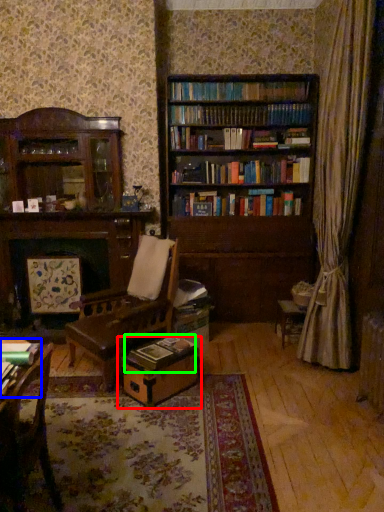
Question: Based on their relative distances, which object is nearer to cardboard box (highlighted by a red box)? Choose from book (highlighted by a blue box) and book (highlighted by a green box).

Choices:
 (A) book
 (B) book

Answer: (B)